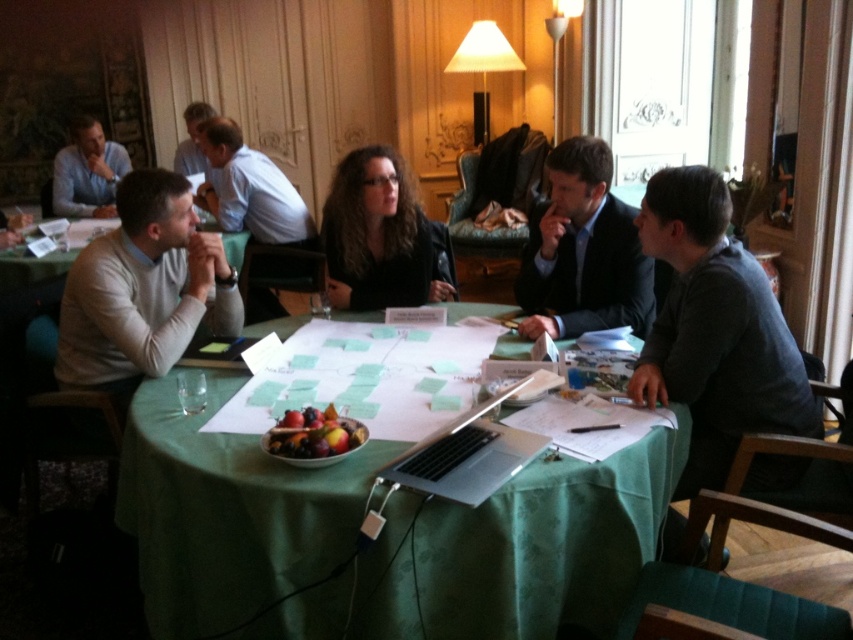
You are standing at the entrance of the room and want to place a new item exactly at the center of the room. The light brown leather jacket at center is currently located at coordinates point 0.297, 0.293. Is the jacket positioned at the center of the room?

The light brown leather jacket at center is located at point (248, 189), which is exactly the center of the room. Therefore, the jacket is positioned at the center of the room.

You are standing at the entrance of the room and want to place a new object exactly at the center of the table. The light brown leather jacket at center is currently occupying the center. Can you determine if the jacket is exactly at the center of the table?

The light brown leather jacket at center is positioned at point coordinates of (248, 189), which is not exactly at the center of the table. Therefore, the jacket is not exactly at the center of the table.